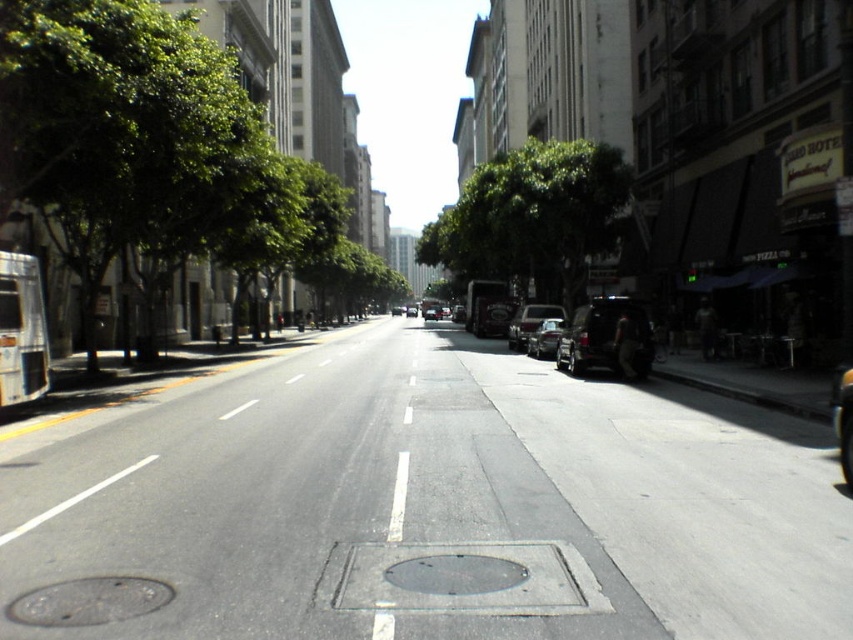
Question: Which object is closer to the camera taking this photo?

Choices:
 (A) green leafy tree at center
 (B) green leafy tree at left
 (C) dark gray metallic van at center-right

Answer: (B)

Question: Which point is closer to the camera taking this photo?

Choices:
 (A) (585, 369)
 (B) (434, 234)
 (C) (543, 310)
 (D) (131, 124)

Answer: (D)

Question: Does green leafy tree at center appear under dark gray metallic van at center-right?

Choices:
 (A) yes
 (B) no

Answer: (B)

Question: Does green leafy tree at left have a smaller size compared to dark gray metallic van at center-right?

Choices:
 (A) yes
 (B) no

Answer: (B)

Question: Among these objects, which one is nearest to the camera?

Choices:
 (A) green leafy tree at left
 (B) green leafy tree at center
 (C) shiny silver sedan at center
 (D) shiny silver car at center

Answer: (A)

Question: Does green leafy tree at center lie in front of dark gray metallic van at center-right?

Choices:
 (A) yes
 (B) no

Answer: (B)